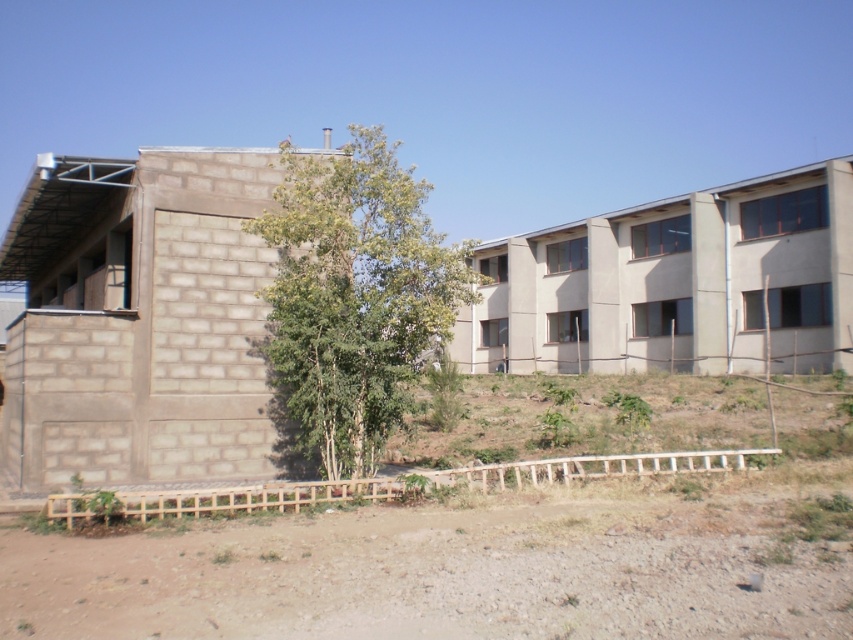
Question: Which of the following is the farthest from the observer?

Choices:
 (A) (473, 600)
 (B) (308, 218)

Answer: (B)

Question: Is brown dirt field at lower center positioned in front of green leafy tree at center?

Choices:
 (A) no
 (B) yes

Answer: (B)

Question: Is brown dirt field at lower center thinner than green leafy tree at center?

Choices:
 (A) yes
 (B) no

Answer: (B)

Question: Which object appears farthest from the camera in this image?

Choices:
 (A) brown dirt field at lower center
 (B) green leafy tree at center

Answer: (B)

Question: Where is brown dirt field at lower center located in relation to green leafy tree at center in the image?

Choices:
 (A) below
 (B) above

Answer: (A)